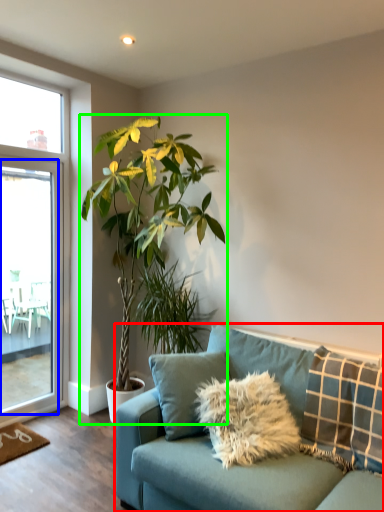
Question: Based on their relative distances, which object is farther from studio couch (highlighted by a red box)? Choose from screen door (highlighted by a blue box) and houseplant (highlighted by a green box).

Choices:
 (A) screen door
 (B) houseplant

Answer: (A)